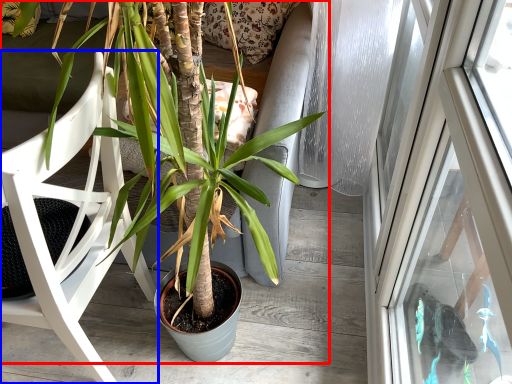
Question: Which point is closer to the camera, houseplant (highlighted by a red box) or chair (highlighted by a blue box)?

Choices:
 (A) houseplant
 (B) chair

Answer: (A)